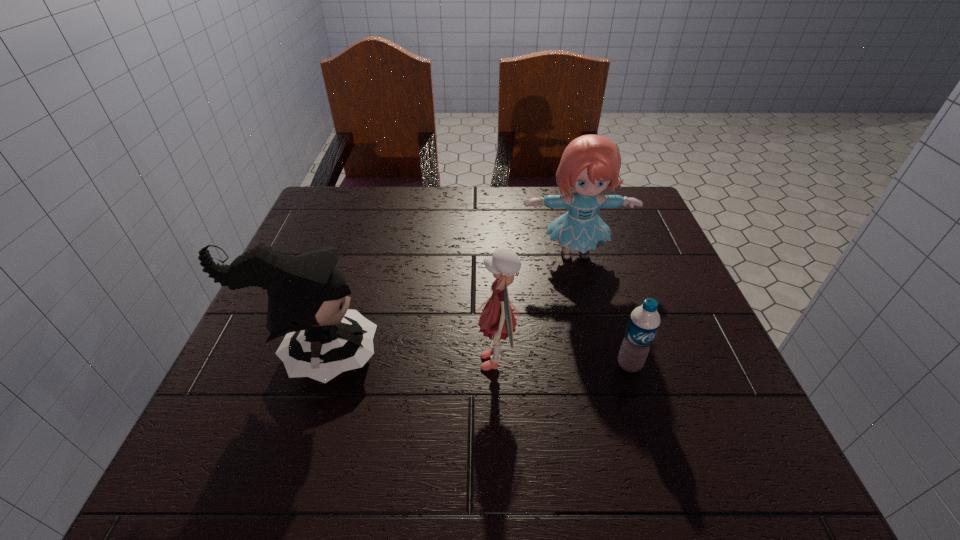
Identify the location of free space between the leftmost doll and the second object from left to right. (406, 359).

Where is `empty location between the second doll from left to right and the rightmost doll`? empty location between the second doll from left to right and the rightmost doll is located at coordinates (536, 308).

Locate an element on the screen. The image size is (960, 540). free space between the farthest object and the second object from left to right is located at coordinates (536, 308).

Image resolution: width=960 pixels, height=540 pixels. Find the location of `vacant point located between the shortest object and the leftmost doll`. vacant point located between the shortest object and the leftmost doll is located at coordinates tap(472, 360).

You are a GUI agent. You are given a task and a screenshot of the screen. Output one action in this format:
    pyautogui.click(x=<x>, y=<y>)
    Task: Click on the empty location between the water bottle and the leftmost object
    The height and width of the screenshot is (540, 960).
    Given the screenshot: What is the action you would take?
    pyautogui.click(x=472, y=360)

I want to click on free point between the water bottle and the farthest doll, so pos(602,309).

Identify the location of empty space between the water bottle and the leftmost doll. Image resolution: width=960 pixels, height=540 pixels. (472, 360).

I want to click on free space between the second object from left to right and the leftmost object, so click(406, 359).

Identify the location of empty space that is in between the shortest object and the farthest object. The height and width of the screenshot is (540, 960). (602, 309).

The image size is (960, 540). Find the location of `the second closest object relative to the water bottle`. the second closest object relative to the water bottle is located at coordinates (590, 163).